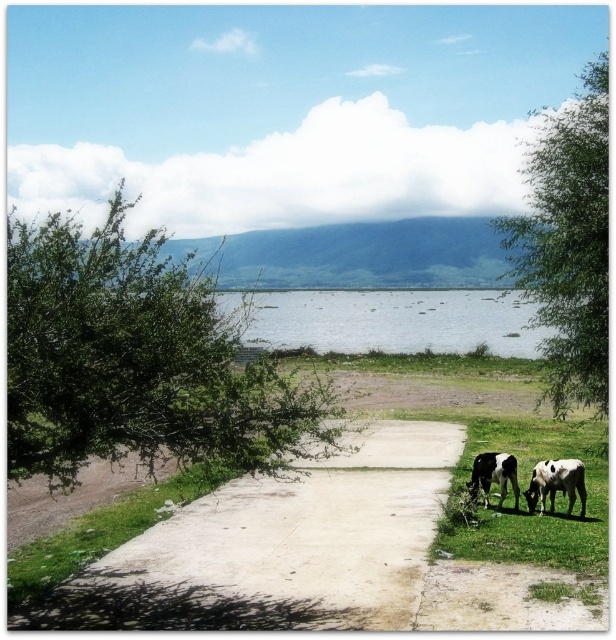
You are standing at the origin point of the scene. Which direction should you walk to reach the green grass at lower right?

The green grass at lower right is located at coordinates point (525,500), so you should walk towards the lower right direction to reach it.

You are standing at the point marked by the coordinates point (525, 500). Looking towards the water, what is the first object you encounter?

The first object you encounter when looking towards the water from point (525, 500) is the green grass at lower right, as it is located at that coordinate point.